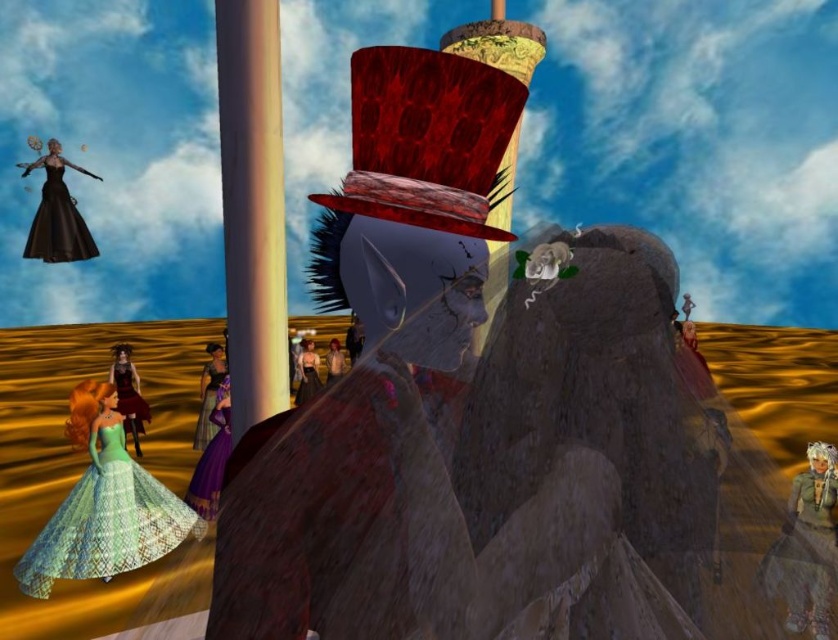
You are a fashion designer observing a surreal digital art piece. You notice two dresses in the scene. The first is a matte gray dress at lower right, and the second is a velvet purple dress at center. Which dress is positioned lower in the image?

The matte gray dress at lower right is positioned lower than the velvet purple dress at center.

You are an artist trying to paint this scene. You want to ensure the proportions between the smooth cream pole at center and the shiny purple fabric dress at lower left are accurate. Which object should you paint first if you want to start with the wider one?

The shiny purple fabric dress at lower left should be painted first since it has a greater width than the smooth cream pole at center according to the description.